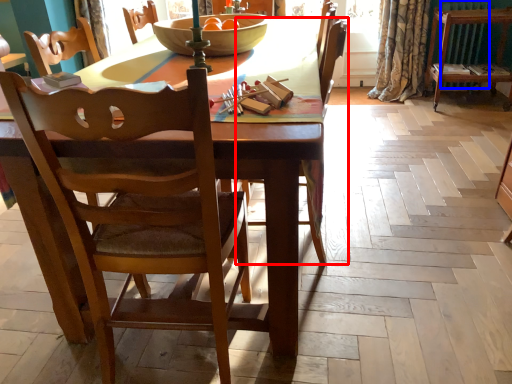
Question: Among these objects, which one is nearest to the camera, chair (highlighted by a red box) or radiator (highlighted by a blue box)?

Choices:
 (A) chair
 (B) radiator

Answer: (A)